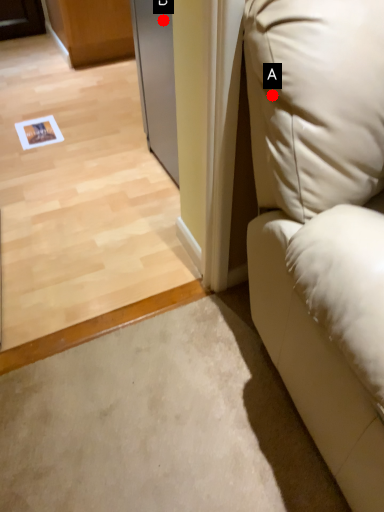
Question: Two points are circled on the image, labeled by A and B beside each circle. Which point is farther to the camera?

Choices:
 (A) A is further
 (B) B is further

Answer: (B)